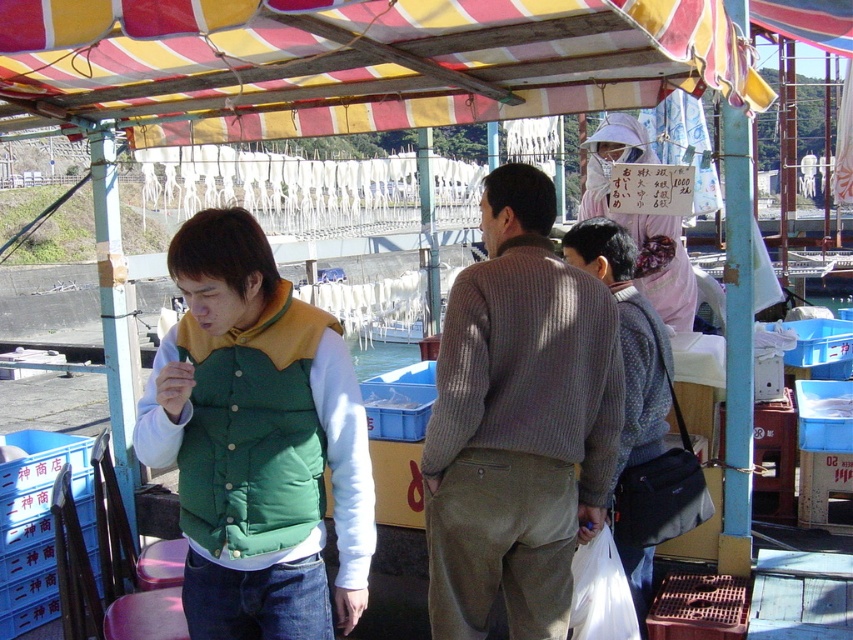
You are a customer at the market and want to know which item takes up more space between the green puffy vest at center and the pink fabric sign at upper center. Which one is it?

The pink fabric sign at upper center takes up more space than the green puffy vest at center because the green puffy vest at center occupies less space than the pink fabric sign at upper center.